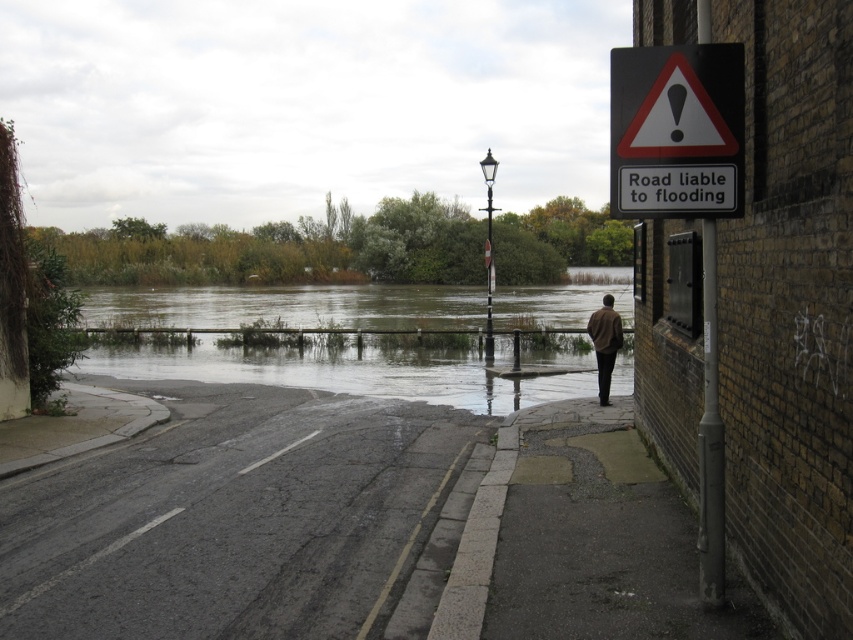
Does gray asphalt pavement at lower center appear on the left side of brown leather jacket at lower right?

Yes, gray asphalt pavement at lower center is to the left of brown leather jacket at lower right.

Is point (206, 564) behind point (605, 346)?

No.

The height and width of the screenshot is (640, 853). I want to click on gray asphalt pavement at lower center, so click(231, 516).

Can you confirm if black plastic sign at upper right is smaller than brown leather jacket at lower right?

Yes.

Does black plastic sign at upper right come behind brown leather jacket at lower right?

No, black plastic sign at upper right is closer to the viewer.

Where is `black plastic sign at upper right`? The height and width of the screenshot is (640, 853). black plastic sign at upper right is located at coordinates (677, 131).

Measure the distance between gray asphalt pavement at lower center and brown wooden fence at center.

gray asphalt pavement at lower center and brown wooden fence at center are 24.07 meters apart.

Which is above, gray asphalt pavement at lower center or brown wooden fence at center?

brown wooden fence at center is above.

At what (x,y) coordinates should I click in order to perform the action: click on gray asphalt pavement at lower center. Please return your answer as a coordinate pair (x, y). Looking at the image, I should click on (231, 516).